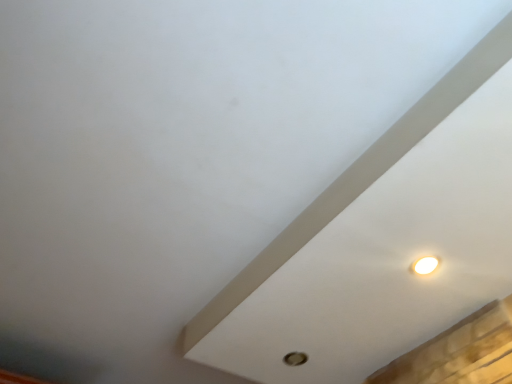
What are the coordinates of `white matte exhaust hood at upper center` in the screenshot? It's located at (391, 254).

What do you see at coordinates (391, 254) in the screenshot?
I see `white matte exhaust hood at upper center` at bounding box center [391, 254].

In order to click on white matte exhaust hood at upper center in this screenshot , I will do `click(391, 254)`.